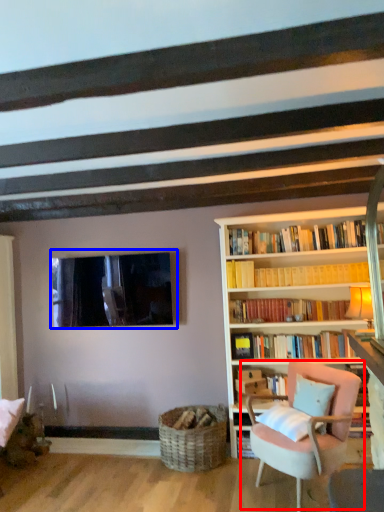
Question: Among these objects, which one is nearest to the camera, chair (highlighted by a red box) or window (highlighted by a blue box)?

Choices:
 (A) chair
 (B) window

Answer: (A)